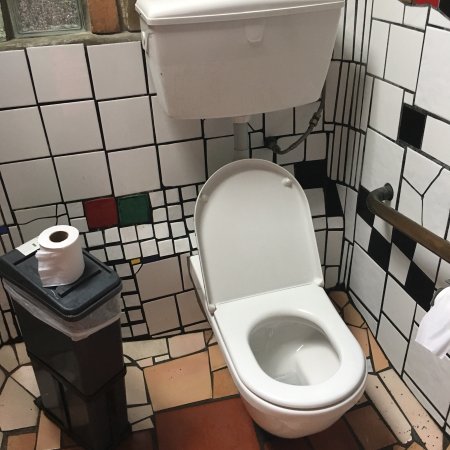
Locate an element on the screen. This screenshot has height=450, width=450. toilet seat cover is located at coordinates (266, 236).